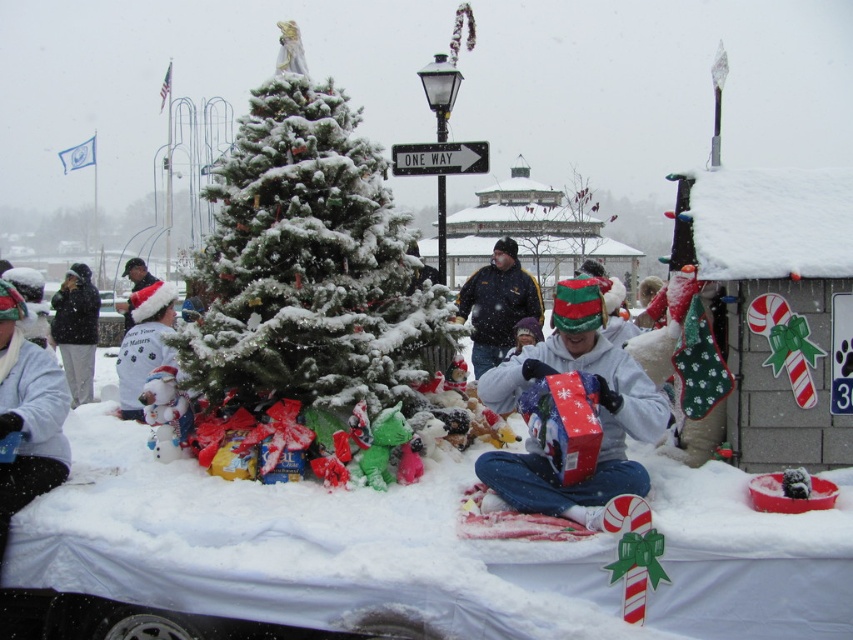
Question: Can you confirm if green textured christmas tree at center is wider than white fleece shirt at left?

Choices:
 (A) yes
 (B) no

Answer: (A)

Question: Among these objects, which one is nearest to the camera?

Choices:
 (A) white fleece jacket at lower left
 (B) green textured christmas tree at center
 (C) white fluffy santa hat at center
 (D) black fleece jacket at left

Answer: (A)

Question: Among these objects, which one is farthest from the camera?

Choices:
 (A) white fluffy santa hat at center
 (B) green textured christmas tree at center
 (C) white fleece shirt at left
 (D) dark blue jacket at center

Answer: (D)

Question: Observing the image, what is the correct spatial positioning of green textured christmas tree at center in reference to white fluffy santa hat at center?

Choices:
 (A) right
 (B) left

Answer: (A)

Question: Which object is farther from the camera taking this photo?

Choices:
 (A) white fleece jacket at lower left
 (B) dark blue jacket at center

Answer: (B)

Question: Is black fleece jacket at left to the left of white fuzzy hat at center from the viewer's perspective?

Choices:
 (A) yes
 (B) no

Answer: (A)